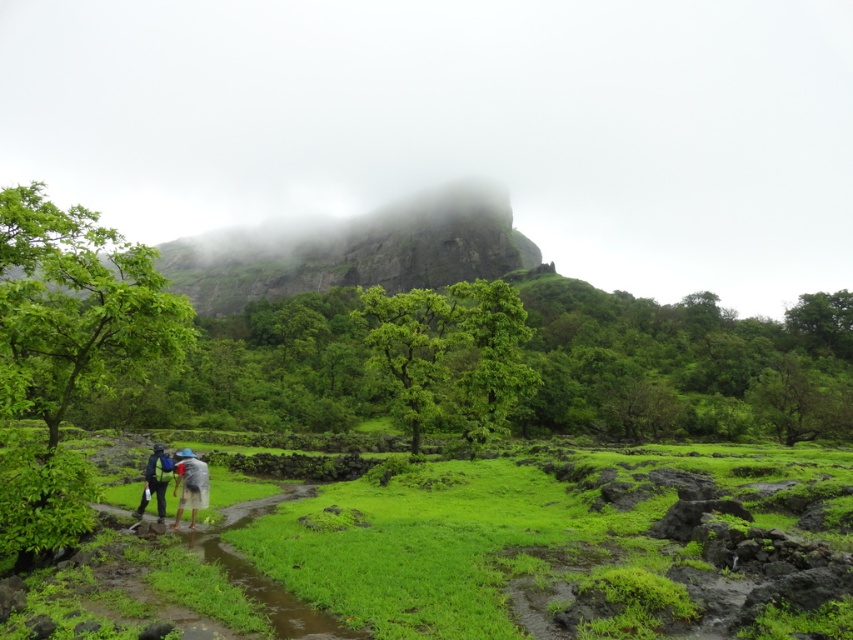
You are planning a hiking trip and see the image. You want to reach the raincoat fabric couple at lower center who are lost. The rocky cliff at upper center is blocking your path. Can you go around it to reach them safely?

The rocky cliff at upper center is in front of the raincoat fabric couple at lower center, so you cannot directly reach them through the cliff. You would need to find an alternative path around the rocky cliff at upper center to safely reach the raincoat fabric couple at lower center.

You are planning to take a photo of the raincoat fabric couple at lower center and the gray fabric umbrella at lower center in this misty mountain landscape. To ensure both subjects are in focus, which one should you focus on first considering their heights?

The raincoat fabric couple at lower center is shorter than the gray fabric umbrella at lower center, so you should focus on the raincoat fabric couple at lower center first to ensure both are in focus.

You are hiking in the mountains and see the rocky cliff at upper center and the gray fabric umbrella at lower center. Which object is closer to you?

The rocky cliff at upper center is closer to you because it is positioned in front of the gray fabric umbrella at lower center.